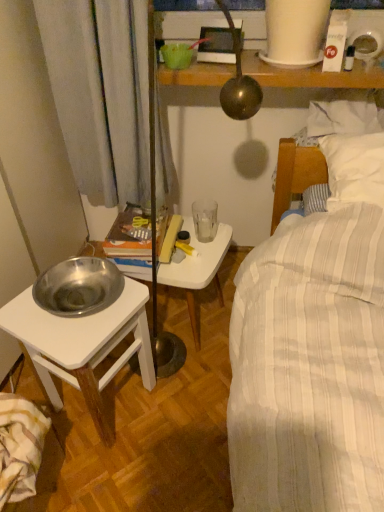
Question: Choose the correct answer: Is transparent glass at center inside striped cotton blanket at lower left or outside it?

Choices:
 (A) inside
 (B) outside

Answer: (B)

Question: Looking at their shapes, would you say transparent glass at center is wider or thinner than striped cotton blanket at lower left?

Choices:
 (A) thin
 (B) wide

Answer: (B)

Question: Considering the real-world distances, which object is closest to the silver metallic bowl at left?

Choices:
 (A) transparent glass at center
 (B) striped cotton blanket at lower left
 (C) white plastic table at center

Answer: (B)

Question: Which of these objects is positioned closest to the white plastic table at center?

Choices:
 (A) striped cotton blanket at lower left
 (B) silver metallic bowl at left
 (C) transparent glass at center

Answer: (C)